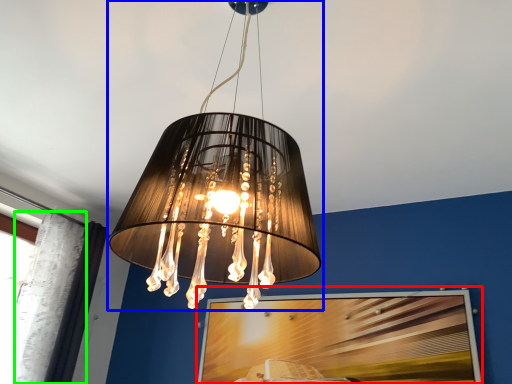
Question: Based on their relative distances, which object is nearer to picture frame (highlighted by a red box)? Choose from lamp (highlighted by a blue box) and curtain (highlighted by a green box).

Choices:
 (A) lamp
 (B) curtain

Answer: (B)